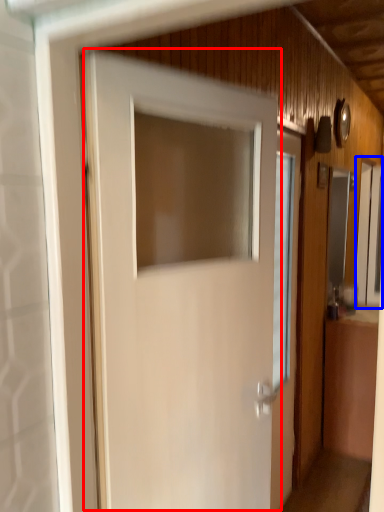
Question: Which point is closer to the camera, door (highlighted by a red box) or window (highlighted by a blue box)?

Choices:
 (A) door
 (B) window

Answer: (A)